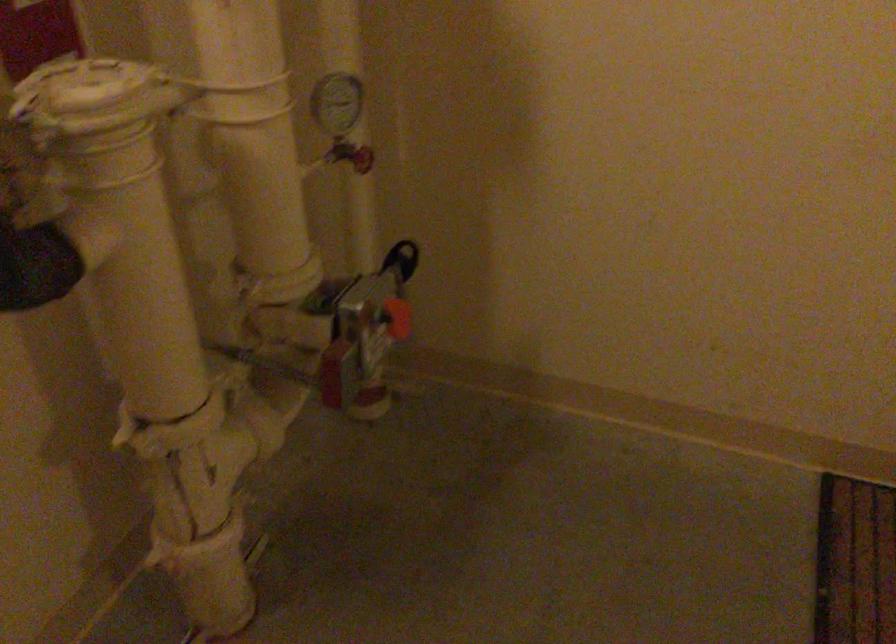
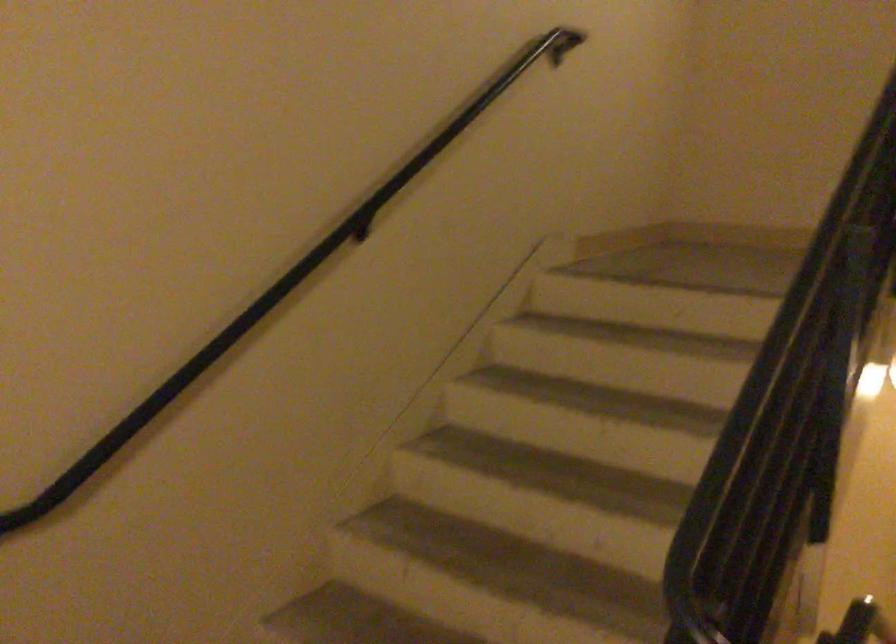
Question: The camera is either moving clockwise (left) or counter-clockwise (right) around the object. The first image is from the beginning of the video and the second image is from the end. Is the camera moving left or right when shooting the video?

Choices:
 (A) Left
 (B) Right

Answer: (A)